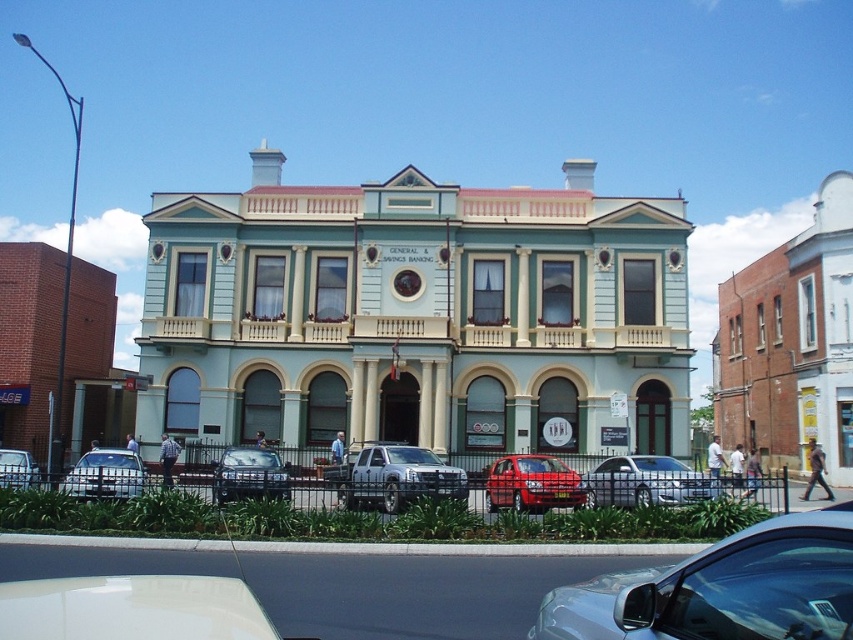
You are a delivery driver who needs to park your vehicle in the parking lot behind the building. The parking space available is only 5 meters long. You have two options to choose from, the silver metallic sedan at center and the matte silver sedan at lower left. Which car would require more space to park?

The silver metallic sedan at center is bigger than the matte silver sedan at lower left, so it would require more space to park. Therefore, the silver metallic sedan at center would need the larger parking space.

You are a delivery driver arriving at the building. You need to park your vehicle in the available space in front of the building. If your vehicle is the metallic silver truck at center, can you move forward to park in front of the shiny red sedan at center?

The metallic silver truck at center is behind the shiny red sedan at center, so yes, you can move forward to park in front of the shiny red sedan at center since it is in front of the truck.

Based on the photo, you are driving a car and want to park in front of the two story teal building with cream accents. There are two silver cars already parked there. Which car, the silver metallic sedan at center or the matte silver sedan at lower left, is positioned closer to the black metal fence?

The matte silver sedan at lower left is closer to the black metal fence because the silver metallic sedan at center is to the right of it, meaning the matte silver sedan at lower left is positioned further left near the fence.